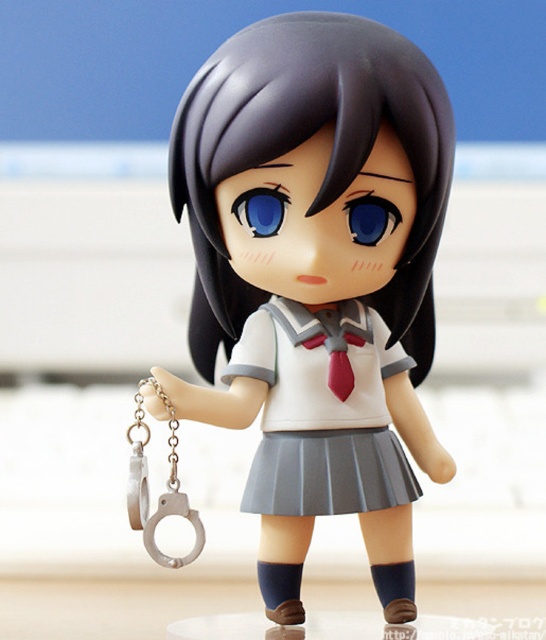
You are observing the image of the anime character holding silver handcuffs. There are two points marked in the image. Which of the two points, point (329, 449) or point (343, 301), is closer to you?

Point (329, 449) is closer to the camera than point (343, 301).

You are an interior designer planning to place a new decorative item in the room shown. The current setup has a matte plastic figure at center located at point (317,280). If you want to place a small vase exactly 0.1 units to the right of the figure, what coordinates should you use?

The coordinates would be 0.438 plus 0.1 in the x direction, so 0.538, 0.581.